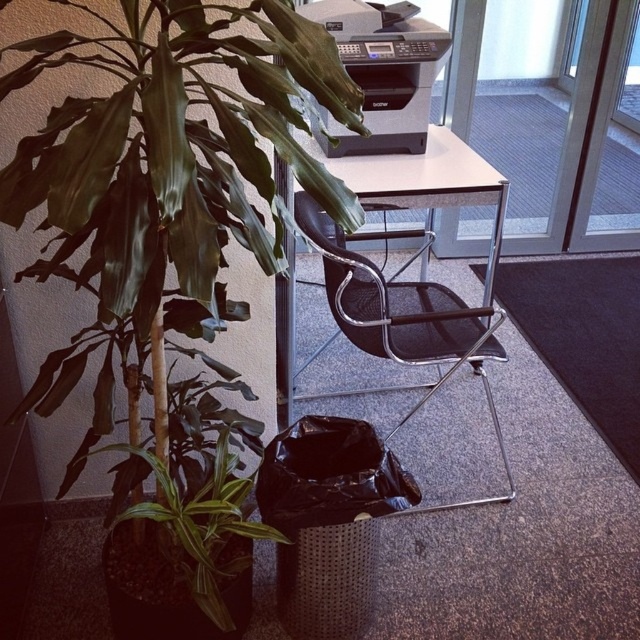
Question: Can you confirm if transparent glass door at upper center is positioned to the right of black plastic printer at upper center?

Choices:
 (A) yes
 (B) no

Answer: (A)

Question: Is black mesh swivel chair at center thinner than black plastic printer at upper center?

Choices:
 (A) yes
 (B) no

Answer: (B)

Question: Estimate the real-world distances between objects in this image. Which object is farther from the green glossy leafy plant at left?

Choices:
 (A) transparent glass door at upper center
 (B) black mesh swivel chair at center

Answer: (A)

Question: Which of the following is the closest to the observer?

Choices:
 (A) black mesh swivel chair at center
 (B) green glossy leafy plant at left
 (C) black plastic printer at upper center
 (D) transparent glass door at upper center

Answer: (B)

Question: Can you confirm if transparent glass door at upper center is wider than black mesh swivel chair at center?

Choices:
 (A) yes
 (B) no

Answer: (A)

Question: Which point is closer to the camera taking this photo?

Choices:
 (A) (396, 312)
 (B) (394, 38)

Answer: (A)